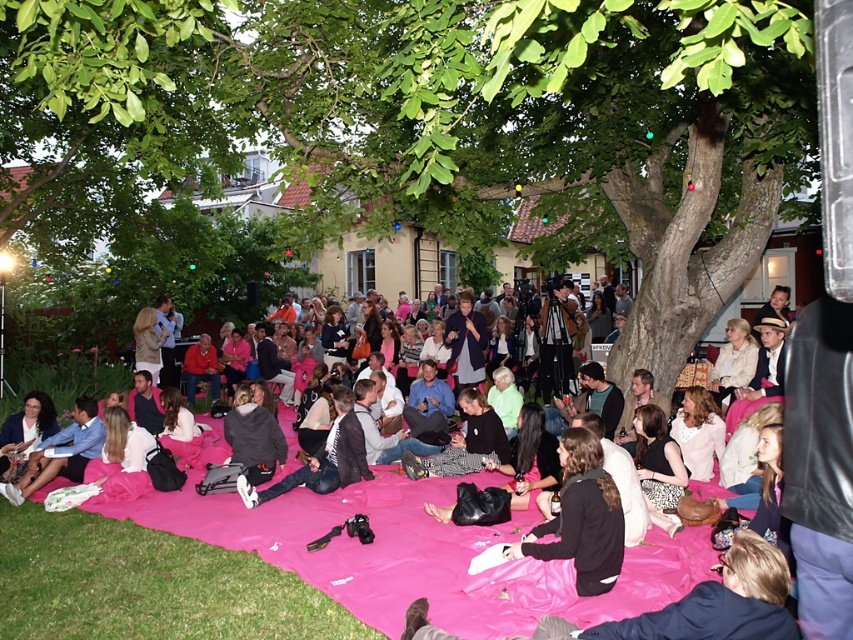
Based on the photo, you are planning to set up an umbrella for shade at this outdoor gathering. The umbrella requires a height of at least 2 meters to provide adequate coverage. Given the height of the green leafy tree at upper center and the matte blue shirt at lower left, can you estimate if the tree is tall enough to accommodate the umbrella?

The green leafy tree at upper center is much taller than the matte blue shirt at lower left. Since the matte blue shirt at lower left is likely worn by a person of average height, which is around 1.6 to 1.8 meters, the tree is likely over 2 meters tall. Therefore, the green leafy tree at upper center should be tall enough to accommodate the umbrella requiring a minimum height of 2 meters.

Based on the photo, you are planning to set up a small tent for shade near the pink fabric blanket at center. The tent requires at least 5 meters of space between it and any existing trees to avoid damage. Based on the scene, will the green leafy tree at upper center interfere with this requirement?

The distance between the green leafy tree at upper center and the pink fabric blanket at center is 7.38 meters. Since the tent needs at least 5 meters of space from the tree, the current distance of 7.38 meters is sufficient, so the green leafy tree at upper center will not interfere with the tent setup.

You are standing in the outdoor gathering area and want to take a photo of the green leafy tree at upper center. If your camera has a maximum focus range of 9 feet, will it be able to capture the tree clearly?

The green leafy tree at upper center is 8.91 feet away from the viewer, which is within the camera maximum focus range of 9 feet. Therefore, the camera can capture the tree clearly.